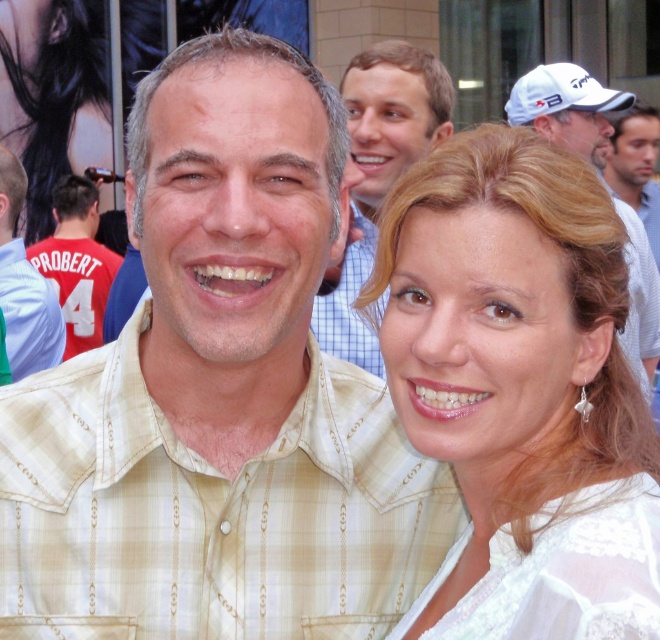
You are a photographer standing at the camera position. You want to adjust the focus so that the light beige plaid shirt at center is sharp. What is the minimum distance you need to focus at to ensure the shirt is in focus?

The light beige plaid shirt at center is 2.04 meters away from the camera, so you should set the focus distance to at least 2.04 meters to ensure it is sharp.

You are a photographer trying to decide which object to focus on first between the red jersey at left and the white textured cap at upper right. Since you want to capture the thinner object first, which one should you choose?

The red jersey at left is thinner than the white textured cap at upper right, so you should focus on the red jersey at left first.